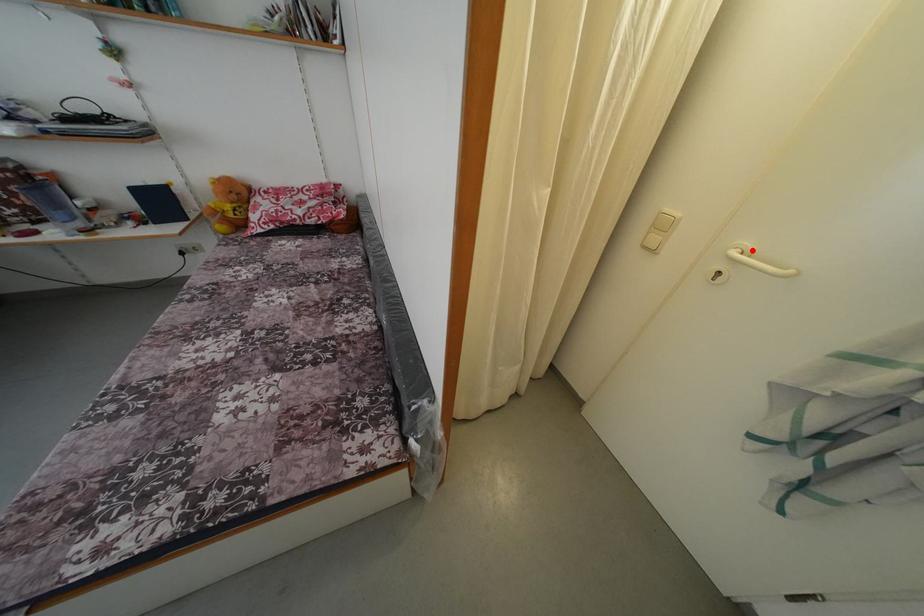
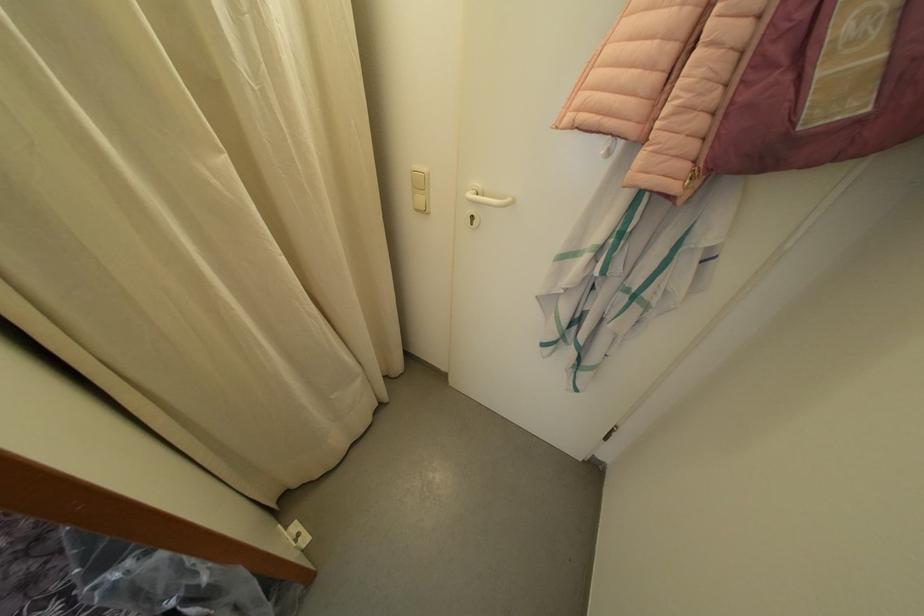
Where in the second image is the point corresponding to the highlighted location from the first image?

(482, 190)